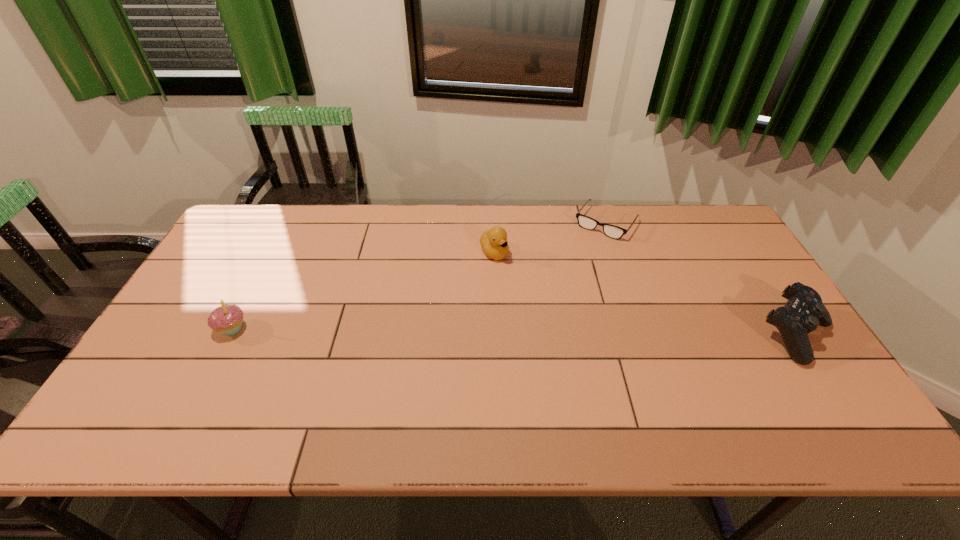
Identify the location of cupcake. The image size is (960, 540). (227, 318).

The height and width of the screenshot is (540, 960). What are the coordinates of `control` in the screenshot? It's located at (804, 311).

The height and width of the screenshot is (540, 960). Identify the location of the third object from right to left. (494, 243).

At what (x,y) coordinates should I click in order to perform the action: click on spectacles. Please return your answer as a coordinate pair (x, y). Looking at the image, I should click on (612, 231).

I want to click on the shortest object, so click(612, 231).

Locate an element on the screen. free space located 0.060m on the back of the cupcake is located at coordinates (247, 301).

The image size is (960, 540). I want to click on free space located 0.130m on the back of the rightmost object, so click(x=756, y=273).

Where is `vacant region located on the face of the duckling`? The image size is (960, 540). vacant region located on the face of the duckling is located at coordinates (575, 348).

Locate an element on the screen. blank space located 0.270m on the face of the duckling is located at coordinates (552, 322).

Identify the location of vacant space located 0.090m on the face of the duckling. (517, 281).